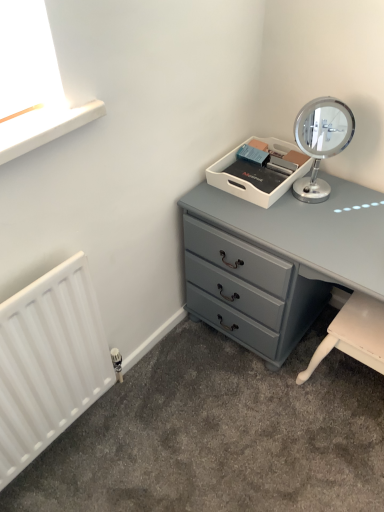
Where is `vacant area to the right of polished chrome mirror at upper right`? The height and width of the screenshot is (512, 384). vacant area to the right of polished chrome mirror at upper right is located at coordinates pos(357,198).